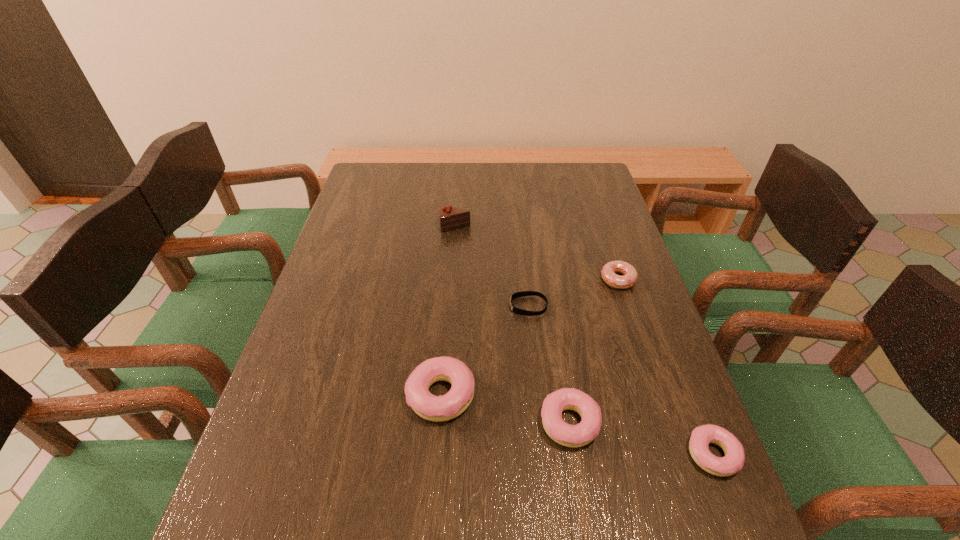
The doughnuts are evenly distributed in the image. To maintain this, where would you place another doughnut on the left? Please point to a free space. Please provide its 2D coordinates. Your answer should be formatted as a tuple, i.e. [(x, y)], where the tuple contains the x and y coordinates of a point satisfying the conditions above.

[(324, 369)]